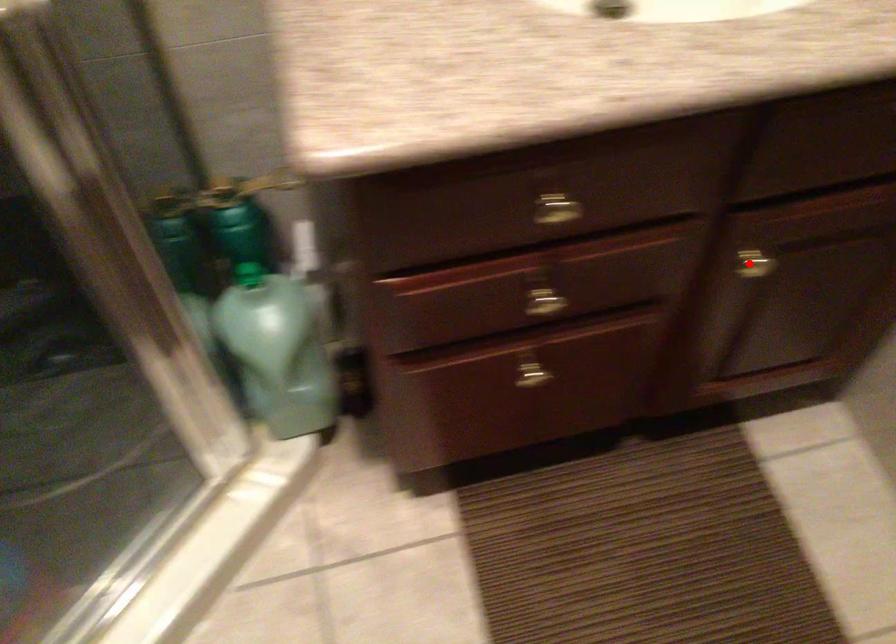
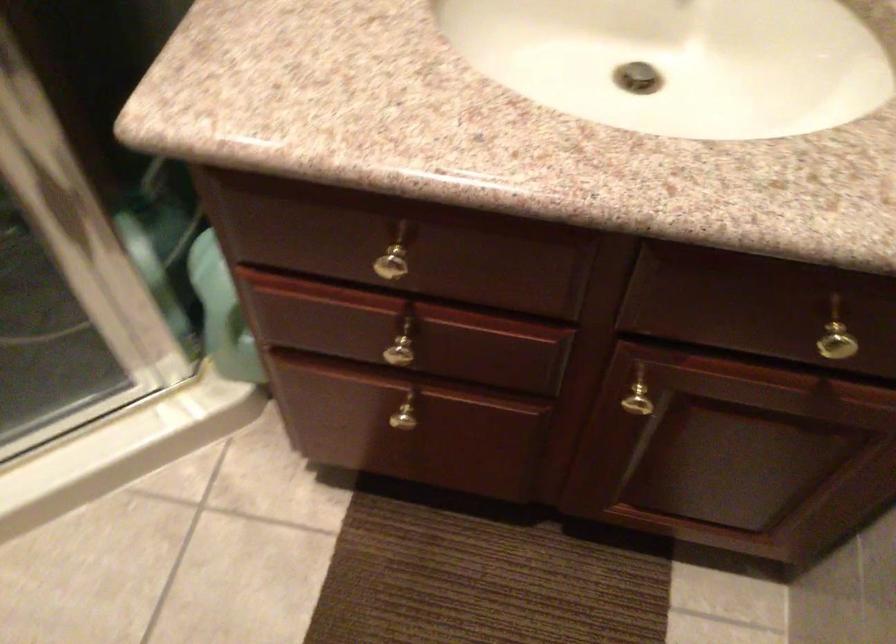
Question: I am providing you with two images of the same scene from different viewpoints. In image1, a red point is highlighted. Considering the same 3D point in image2, which of the following is correct?

Choices:
 (A) It is closer
 (B) It is farther

Answer: (A)